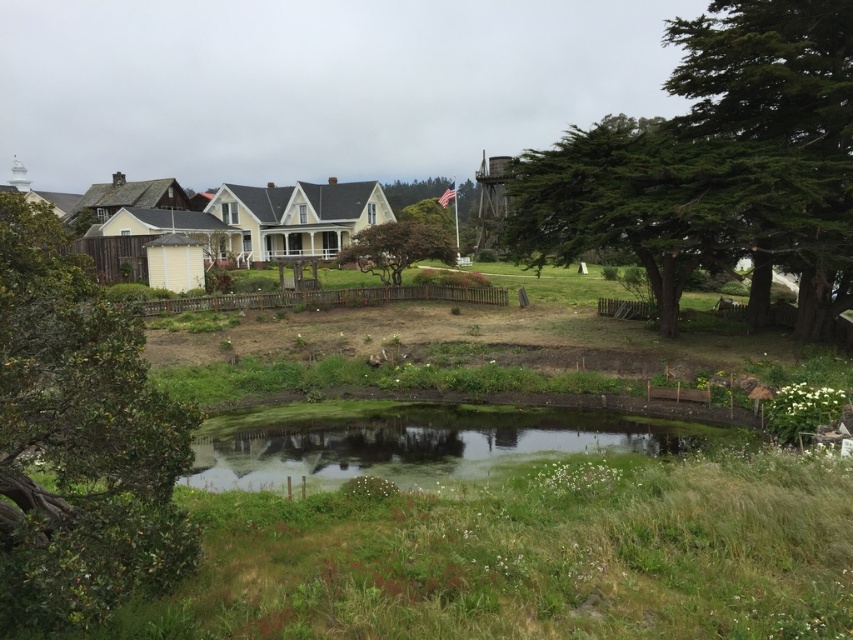
You are standing in the rural scene and want to take a photo of both the green leafy tree at left and the brown textured tree at center. Which tree should you focus on first to ensure both are in the frame?

The green leafy tree at left is below the brown textured tree at center, so you should focus on the brown textured tree at center first to ensure both are in the frame.

You are standing at the edge of the pond in the rural scene and want to place a small decorative rock. You have two options for placement coordinates based on the image points provided. Which point, point (x=770, y=92) or point (x=682, y=260), is closer to you where you are standing?

Point (x=770, y=92) is closer to the camera than point (x=682, y=260), so you should place the rock at point (x=770, y=92) since it is closer to your current position at the pond edge.